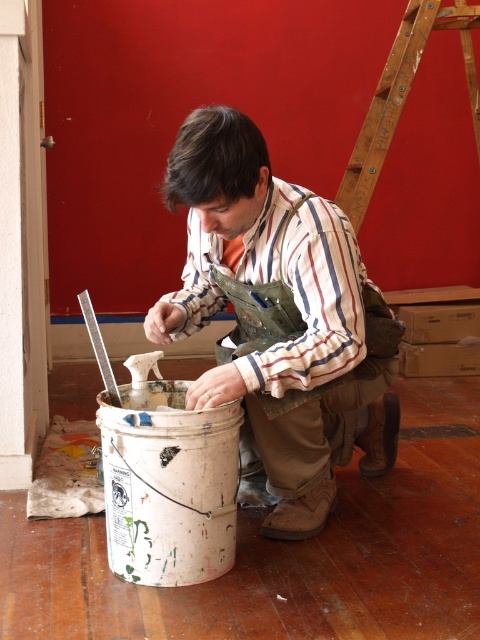
You are an observer standing in the same room as the person in the image. You notice the matte striped shirt at center and the wooden ladder at upper right. Which object is taller?

The matte striped shirt at center is taller than the wooden ladder at upper right.

You are an observer looking at the scene. The person in the matte striped shirt at center is working near a wooden ladder at upper right. Which object is positioned higher in the image?

The wooden ladder at upper right is positioned higher than the matte striped shirt at center in the image.